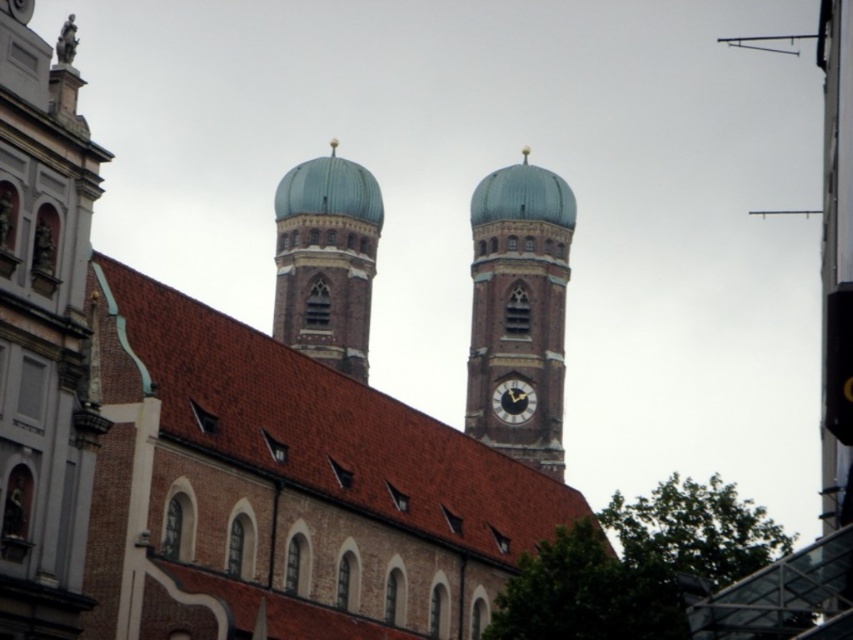
Question: Can you confirm if blue-tiled clock tower at center is positioned above dark brown wooden clock at center?

Choices:
 (A) yes
 (B) no

Answer: (A)

Question: Which of these objects is positioned farthest from the teal glazed dome at center?

Choices:
 (A) dark brown wooden clock at center
 (B) brown brick church at center
 (C) blue-tiled clock tower at center

Answer: (A)

Question: Which object is positioned farthest from the blue-tiled clock tower at center?

Choices:
 (A) dark brown wooden clock at center
 (B) teal glazed dome at center

Answer: (B)

Question: Which object is farther from the camera taking this photo?

Choices:
 (A) blue-tiled clock tower at center
 (B) teal glazed dome at center
 (C) dark brown wooden clock at center

Answer: (B)

Question: Can you confirm if brown brick church at center is positioned above dark brown wooden clock at center?

Choices:
 (A) no
 (B) yes

Answer: (B)

Question: Does teal glazed dome at center appear on the right side of dark brown wooden clock at center?

Choices:
 (A) no
 (B) yes

Answer: (A)